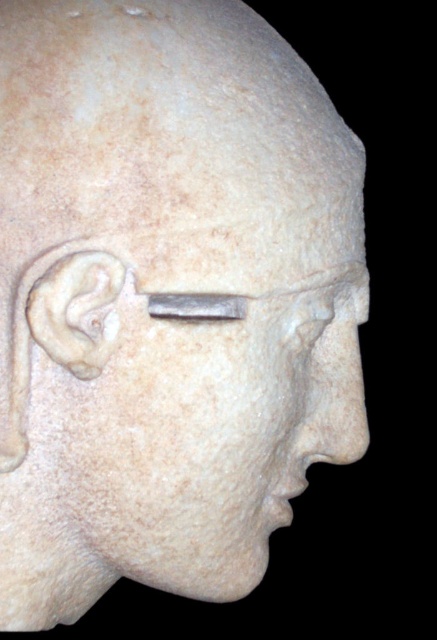
Question: Considering the relative positions of matte stone forehead at upper center and white marble ear at left in the image provided, where is matte stone forehead at upper center located with respect to white marble ear at left?

Choices:
 (A) right
 (B) left

Answer: (A)

Question: Which object appears closest to the camera in this image?

Choices:
 (A) matte stone forehead at upper center
 (B) white marble ear at left

Answer: (B)

Question: Considering the relative positions of matte stone forehead at upper center and white marble ear at left in the image provided, where is matte stone forehead at upper center located with respect to white marble ear at left?

Choices:
 (A) left
 (B) right

Answer: (B)

Question: Does matte stone forehead at upper center appear on the left side of white marble ear at left?

Choices:
 (A) no
 (B) yes

Answer: (A)